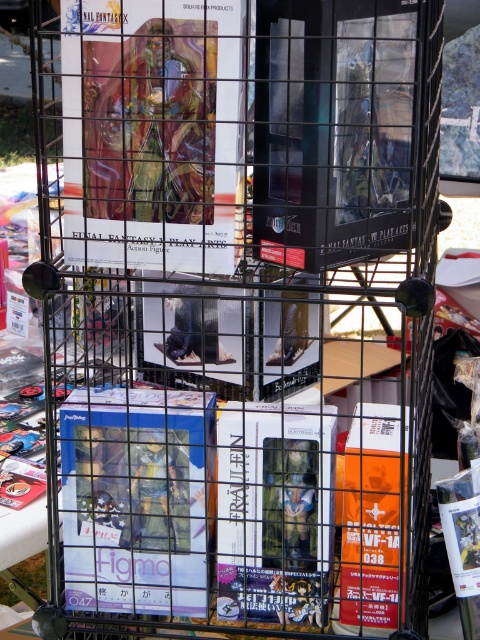
You are a customer who wants to reach the matte plastic figure at center from the large box labeled Final Fantasy VII Play Arts on the top shelf. Can you grab it without moving any items?

The matte plastic figure at center is 1.24 meters away from the large box labeled Final Fantasy VII Play Arts on the top shelf. Since the distance is more than arm length, you cannot grab it without moving items.